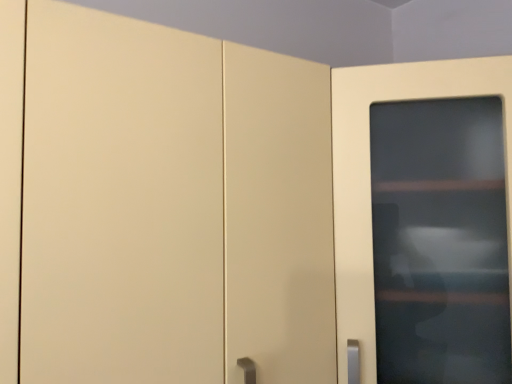
Describe the element at coordinates (423, 221) in the screenshot. I see `matte white cabinet door at right` at that location.

Image resolution: width=512 pixels, height=384 pixels. Identify the location of matte white cabinet door at right. (423, 221).

Find the location of a particular element. The width and height of the screenshot is (512, 384). matte white cabinet door at right is located at coordinates (423, 221).